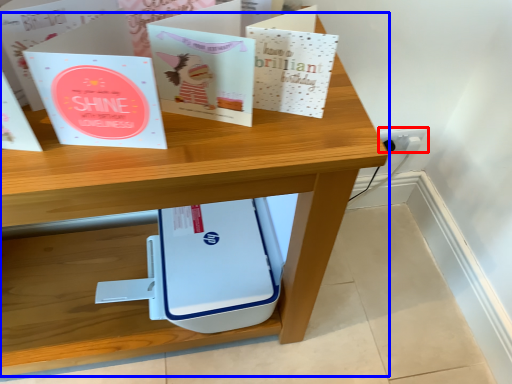
Question: Among these objects, which one is nearest to the camera, electric outlet (highlighted by a red box) or desk (highlighted by a blue box)?

Choices:
 (A) electric outlet
 (B) desk

Answer: (B)